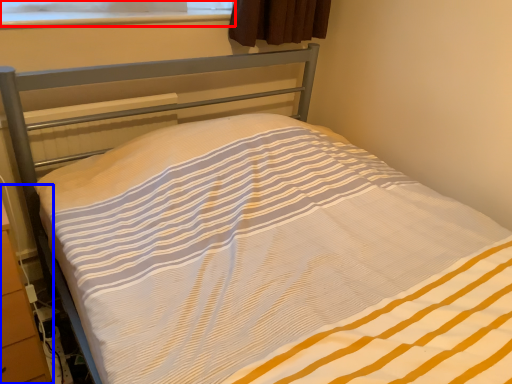
Question: Among these objects, which one is nearest to the camera, window screen (highlighted by a red box) or dresser (highlighted by a blue box)?

Choices:
 (A) window screen
 (B) dresser

Answer: (B)